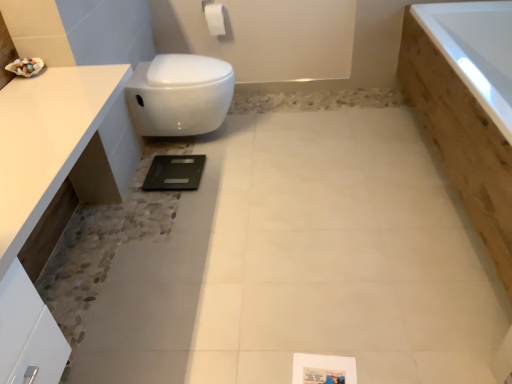
Locate an element on the screen. Image resolution: width=512 pixels, height=384 pixels. vacant region under white glossy countertop at upper left (from a real-world perspective) is located at coordinates (93, 285).